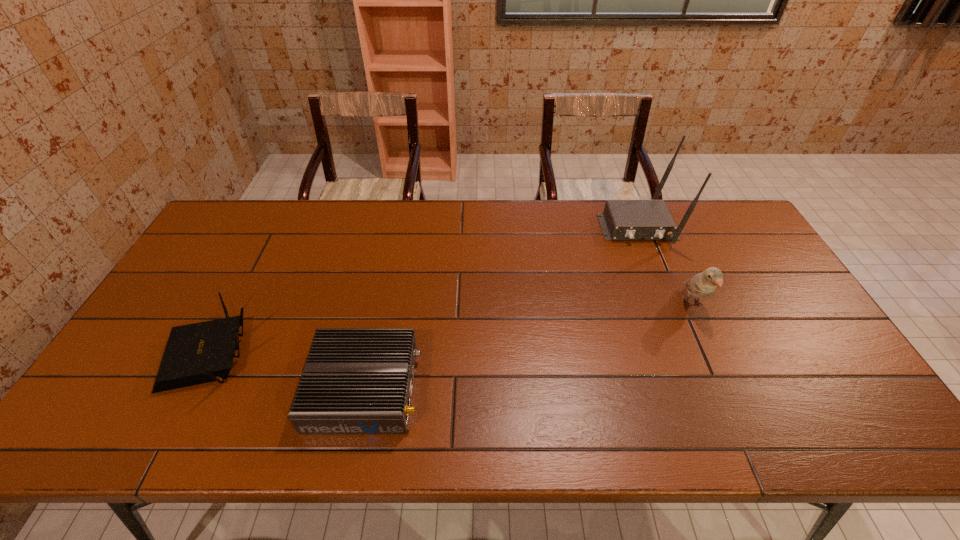
The width and height of the screenshot is (960, 540). I want to click on object that is the closest one to the farthest object, so click(703, 284).

At what (x,y) coordinates should I click in order to perform the action: click on router that stands as the second closest to the farthest router. Please return your answer as a coordinate pair (x, y). Looking at the image, I should click on (198, 353).

The image size is (960, 540). I want to click on router object that ranks as the closest to the tallest router, so click(x=355, y=380).

The image size is (960, 540). I want to click on vacant space that satisfies the following two spatial constraints: 1. at the face of the bird; 2. on the back panel of the shortest object, so click(731, 388).

Identify the location of vacant space that satisfies the following two spatial constraints: 1. at the face of the bird; 2. on the back panel of the shortest object. (731, 388).

Where is `free space that satisfies the following two spatial constraints: 1. at the face of the third shortest object; 2. on the back panel of the second router from left to right`? free space that satisfies the following two spatial constraints: 1. at the face of the third shortest object; 2. on the back panel of the second router from left to right is located at coordinates (731, 388).